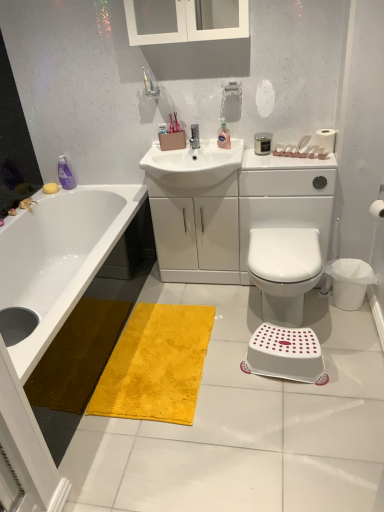
This screenshot has height=512, width=384. What are the coordinates of `free location in front of white plastic step stool at lower center` in the screenshot? It's located at (305, 415).